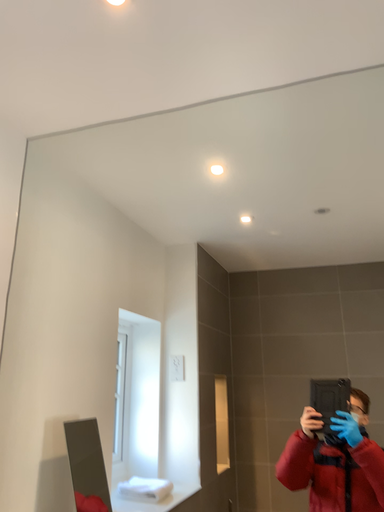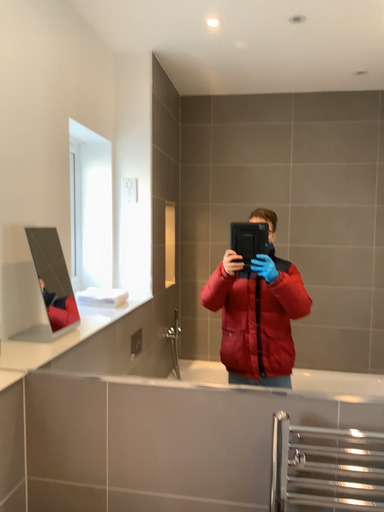
Question: How did the camera likely rotate when shooting the video?

Choices:
 (A) rotated right
 (B) rotated left

Answer: (A)